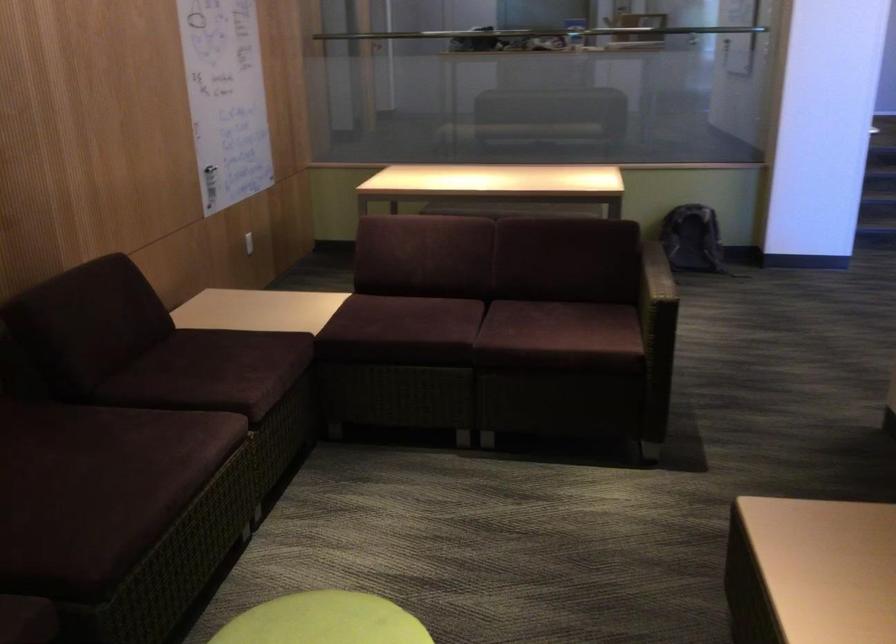
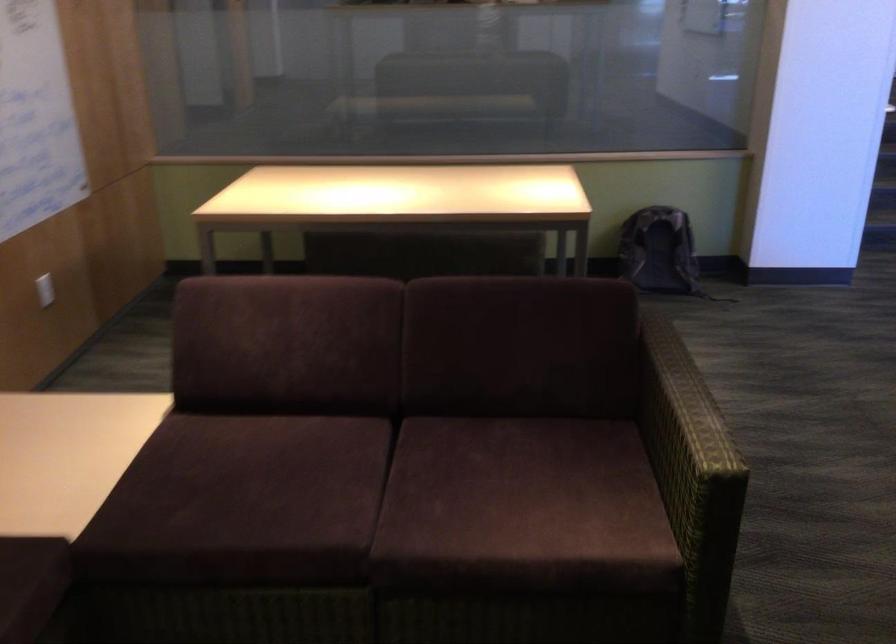
In the second image, find the point that corresponds to pixel 566 319 in the first image.

(526, 474)